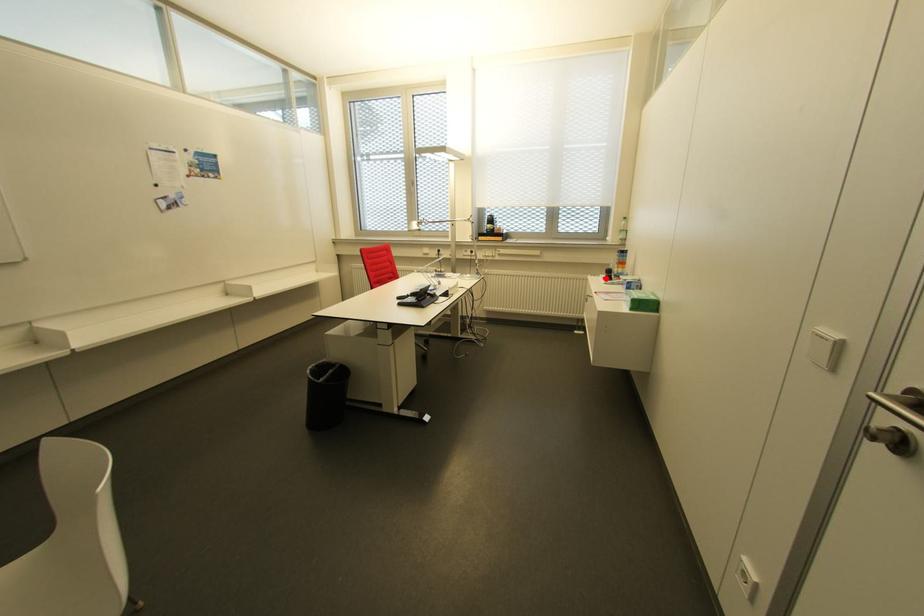
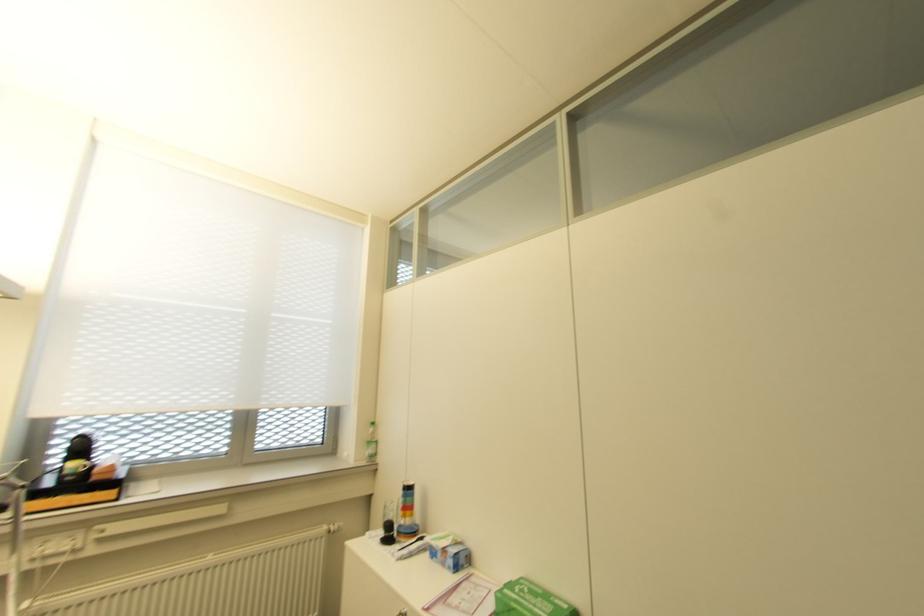
Find the pixel in the second image that matches the highlighted location in the first image.

(385, 540)